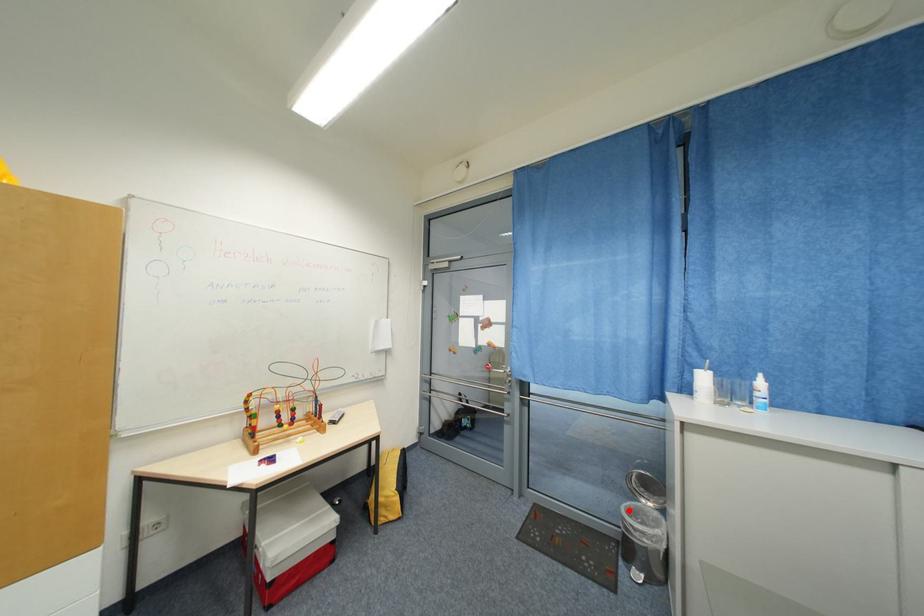
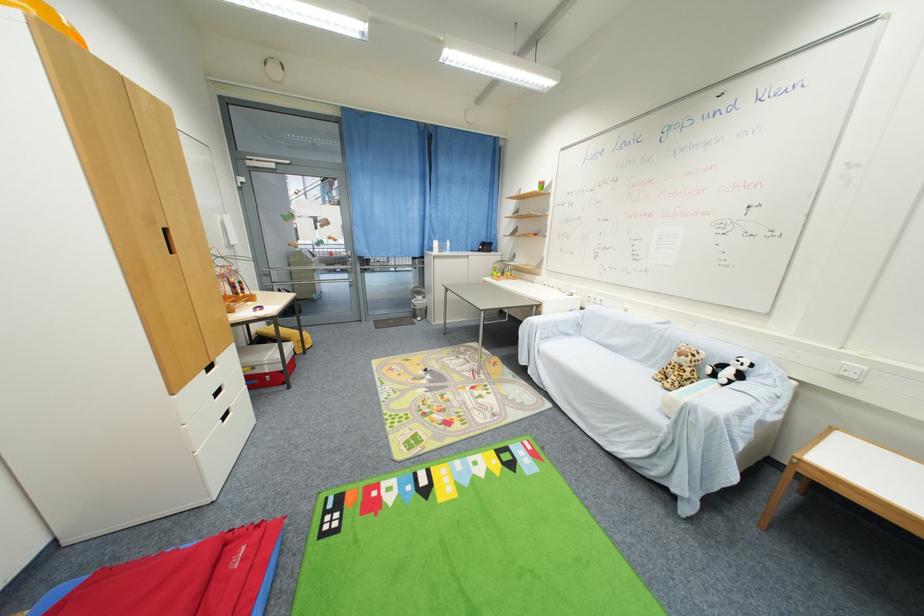
Where in the second image is the point corresponding to the highlighted location from the first image?

(418, 302)